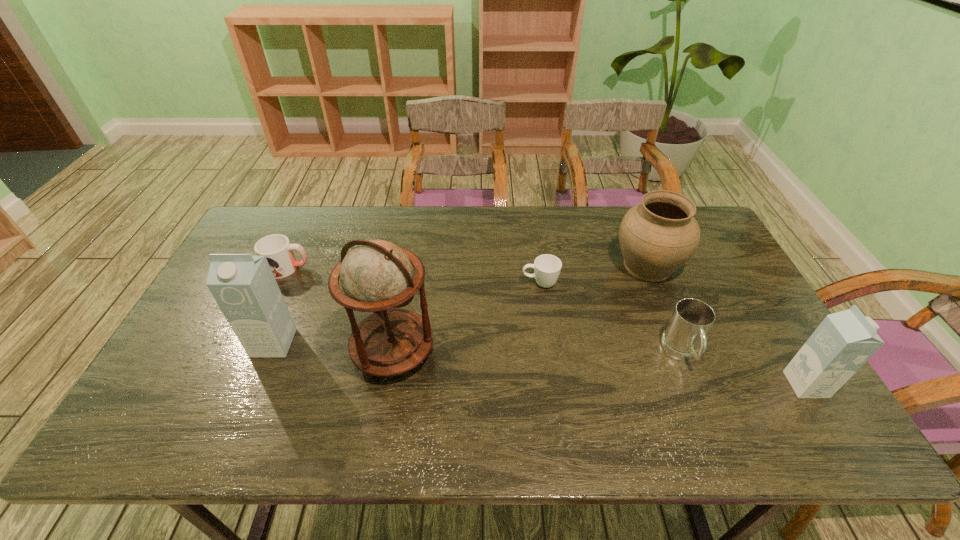
The height and width of the screenshot is (540, 960). I want to click on spot to insert another carton for uniform distribution, so click(529, 363).